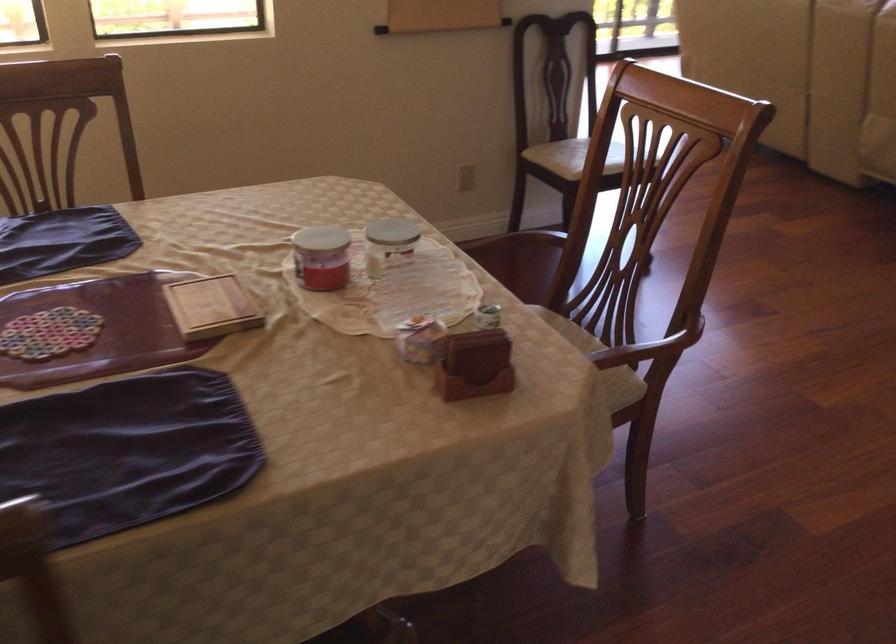
The location [321,257] corresponds to which object?

It refers to a red candle jar.